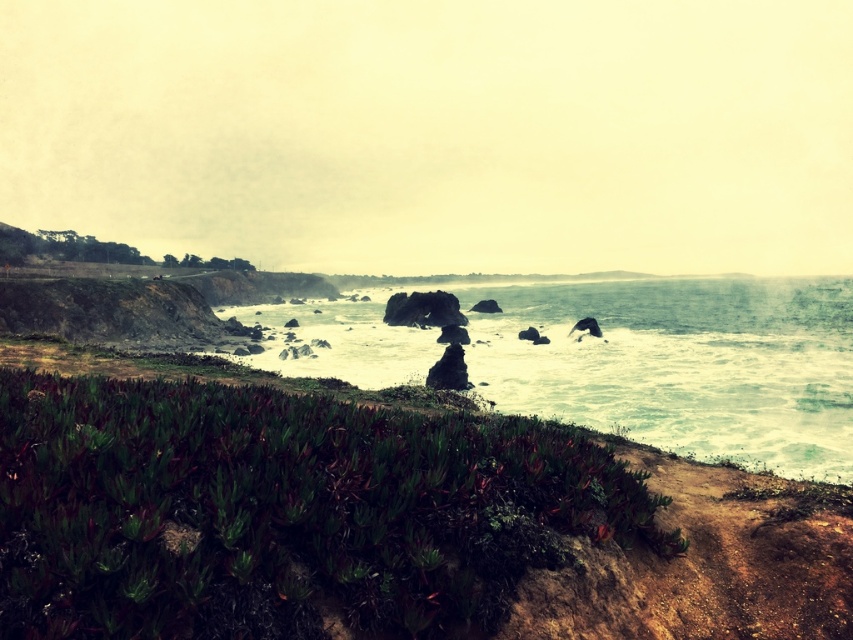
Consider the image. You are a botanist studying plant growth in coastal areas. You observe the green succulent at center and the white frothy water at center in the image. Which of these two has a smaller width?

The green succulent at center has a lesser width compared to the white frothy water at center.

You are standing on the coast and see the green succulent at center and the white frothy water at center. Which object is closer to you?

The green succulent at center is closer to you because it is in front of the white frothy water at center.